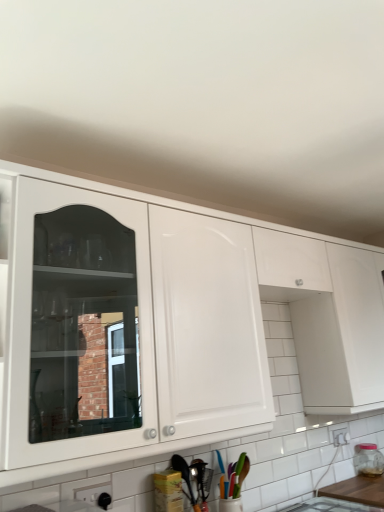
Question: Should I look upward or downward to see transparent glass jar at right?

Choices:
 (A) up
 (B) down

Answer: (B)

Question: Can you confirm if metallic silver spoon at lower center is shorter than wooden at lower right?

Choices:
 (A) no
 (B) yes

Answer: (A)

Question: Can you confirm if metallic silver spoon at lower center is positioned to the left of wooden at lower right?

Choices:
 (A) yes
 (B) no

Answer: (A)

Question: Is metallic silver spoon at lower center bigger than wooden at lower right?

Choices:
 (A) yes
 (B) no

Answer: (B)

Question: Is metallic silver spoon at lower center further to camera compared to wooden at lower right?

Choices:
 (A) no
 (B) yes

Answer: (A)

Question: Could you tell me if metallic silver spoon at lower center is facing wooden at lower right?

Choices:
 (A) no
 (B) yes

Answer: (A)

Question: Is metallic silver spoon at lower center positioned with its back to wooden at lower right?

Choices:
 (A) no
 (B) yes

Answer: (A)

Question: From the image's perspective, is metallic silver spoon at lower center located beneath white glossy cabinet at upper center?

Choices:
 (A) no
 (B) yes

Answer: (B)

Question: Can you confirm if metallic silver spoon at lower center is wider than white glossy cabinet at upper center?

Choices:
 (A) yes
 (B) no

Answer: (B)

Question: Can you confirm if metallic silver spoon at lower center is taller than white glossy cabinet at upper center?

Choices:
 (A) no
 (B) yes

Answer: (A)

Question: Considering the relative sizes of metallic silver spoon at lower center and white glossy cabinet at upper center in the image provided, is metallic silver spoon at lower center bigger than white glossy cabinet at upper center?

Choices:
 (A) no
 (B) yes

Answer: (A)

Question: Does metallic silver spoon at lower center have a lesser width compared to white glossy cabinet at upper center?

Choices:
 (A) yes
 (B) no

Answer: (A)

Question: Considering the relative positions of metallic silver spoon at lower center and white glossy cabinet at upper center in the image provided, is metallic silver spoon at lower center to the left of white glossy cabinet at upper center from the viewer's perspective?

Choices:
 (A) no
 (B) yes

Answer: (A)

Question: Is transparent glass jar at right a part of wooden at lower right?

Choices:
 (A) no
 (B) yes

Answer: (A)